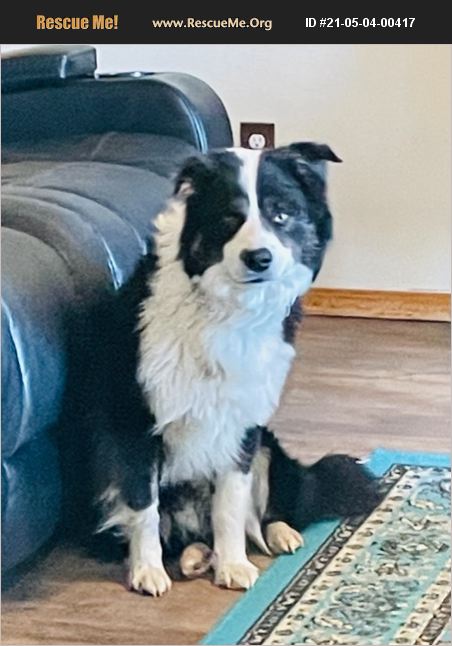
Identify the location of rug. The height and width of the screenshot is (646, 452). (383, 575).